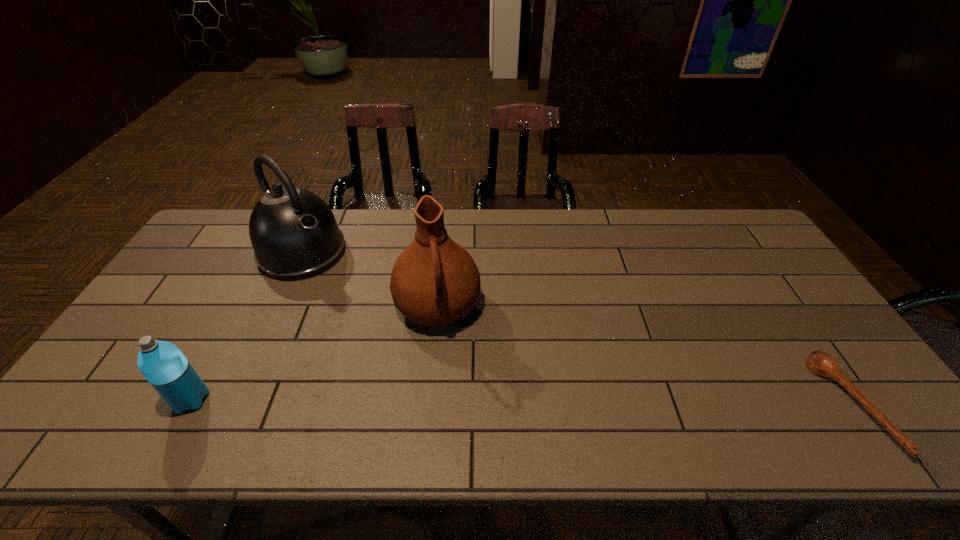
Locate an element on the screen. The height and width of the screenshot is (540, 960). vacant space on the desktop that is between the thermos bottle and the wooden spoon and is positioned on the side of the third object from left to right with the handle is located at coordinates (453, 402).

The width and height of the screenshot is (960, 540). I want to click on vacant space on the desktop that is between the thermos bottle and the rightmost object and is positioned on the spout of the kettle, so click(x=474, y=402).